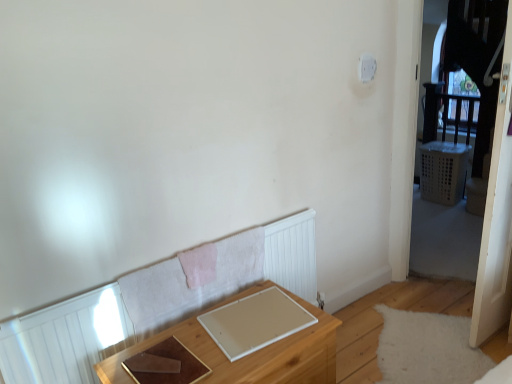
Locate an element on the screen. Image resolution: width=512 pixels, height=384 pixels. white plastic light switch at upper right is located at coordinates (366, 68).

Based on the photo, how far apart are wooden table at lower center and transparent plastic screen door at right?

The distance of wooden table at lower center from transparent plastic screen door at right is 3.76 feet.

Is wooden table at lower center wider than transparent plastic screen door at right?

Yes.

Is wooden table at lower center to the right of transparent plastic screen door at right from the viewer's perspective?

No.

Are wooden table at lower center and transparent plastic screen door at right far apart?

Yes.

Find the location of a particular element. This screenshot has width=512, height=384. light switch positioned vertically above the transparent plastic screen door at right (from a real-world perspective) is located at coordinates (366, 68).

Can you tell me how much white plastic light switch at upper right and transparent plastic screen door at right differ in facing direction?

The angular difference between white plastic light switch at upper right and transparent plastic screen door at right is 0.496 degrees.

In the scene shown: Is white plastic light switch at upper right located outside transparent plastic screen door at right?

white plastic light switch at upper right is positioned outside transparent plastic screen door at right.

Is white plastic light switch at upper right turned away from transparent plastic screen door at right?

No, white plastic light switch at upper right is not facing away from transparent plastic screen door at right.

This screenshot has height=384, width=512. Identify the location of table that is on the left side of transparent plastic screen door at right. (249, 354).

Which is closer to the camera, (x=509, y=111) or (x=310, y=349)?

Clearly, point (x=509, y=111) is more distant from the camera than point (x=310, y=349).

How much distance is there between transparent plastic screen door at right and wooden table at lower center?

They are 3.76 feet apart.

Is the position of transparent plastic screen door at right less distant than that of wooden table at lower center?

No.

Is wooden table at lower center shorter than white plastic light switch at upper right?

Incorrect, the height of wooden table at lower center does not fall short of that of white plastic light switch at upper right.

Choose the correct answer: Is wooden table at lower center inside white plastic light switch at upper right or outside it?

wooden table at lower center is outside white plastic light switch at upper right.

Who is smaller, wooden table at lower center or white plastic light switch at upper right?

Smaller between the two is white plastic light switch at upper right.

From a real-world perspective, which object stands above the other?

In real-world perspective, white plastic light switch at upper right is above.

Could you tell me if transparent plastic screen door at right is turned towards white plastic light switch at upper right?

No, transparent plastic screen door at right is not oriented towards white plastic light switch at upper right.

Between transparent plastic screen door at right and white plastic light switch at upper right, which one has smaller size?

Smaller between the two is white plastic light switch at upper right.

The height and width of the screenshot is (384, 512). Identify the location of table in front of the white plastic light switch at upper right. (249, 354).

Is point (368, 74) closer to viewer compared to point (259, 382)?

That is False.

Is the position of white plastic light switch at upper right more distant than that of wooden table at lower center?

Yes, it is.

Locate an element on the screen. This screenshot has height=384, width=512. screen door lying above the wooden table at lower center (from the image's perspective) is located at coordinates (497, 218).

At what (x,y) coordinates should I click in order to perform the action: click on screen door in front of the white plastic light switch at upper right. Please return your answer as a coordinate pair (x, y). Looking at the image, I should click on (497, 218).

Looking at the image, which one is located closer to white plastic light switch at upper right, wooden table at lower center or transparent plastic screen door at right?

Based on the image, transparent plastic screen door at right appears to be nearer to white plastic light switch at upper right.

Which object lies nearer to the anchor point wooden table at lower center, white plastic light switch at upper right or transparent plastic screen door at right?

Among the two, transparent plastic screen door at right is located nearer to wooden table at lower center.

When comparing their distances from transparent plastic screen door at right, does white plastic light switch at upper right or wooden table at lower center seem further?

wooden table at lower center is positioned further to the anchor transparent plastic screen door at right.

Estimate the real-world distances between objects in this image. Which object is further from transparent plastic screen door at right, wooden table at lower center or white plastic light switch at upper right?

wooden table at lower center is further to transparent plastic screen door at right.

Estimate the real-world distances between objects in this image. Which object is closer to wooden table at lower center, transparent plastic screen door at right or white plastic light switch at upper right?

transparent plastic screen door at right.

Estimate the real-world distances between objects in this image. Which object is further from white plastic light switch at upper right, transparent plastic screen door at right or wooden table at lower center?

wooden table at lower center.

Image resolution: width=512 pixels, height=384 pixels. Identify the location of screen door between white plastic light switch at upper right and wooden table at lower center in the up-down direction. (497, 218).